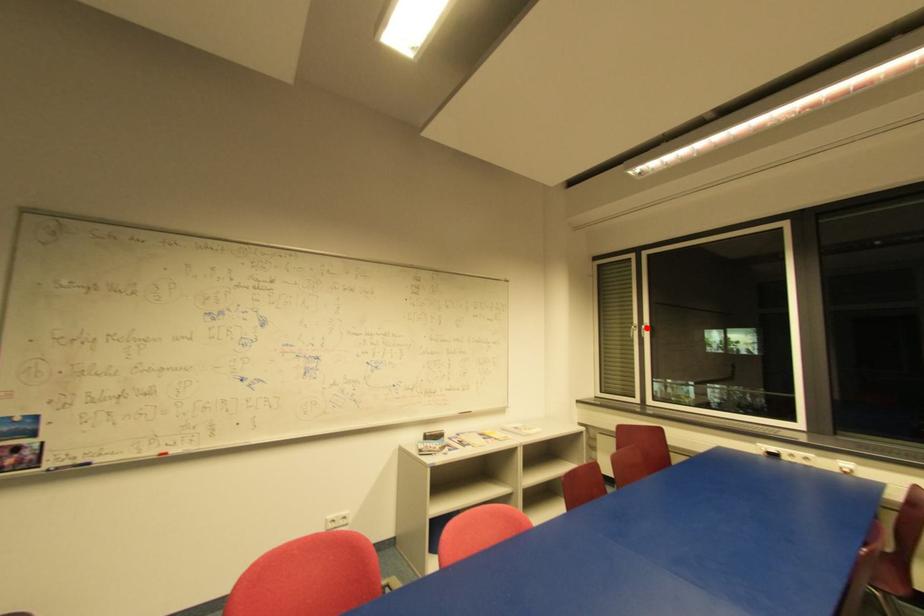
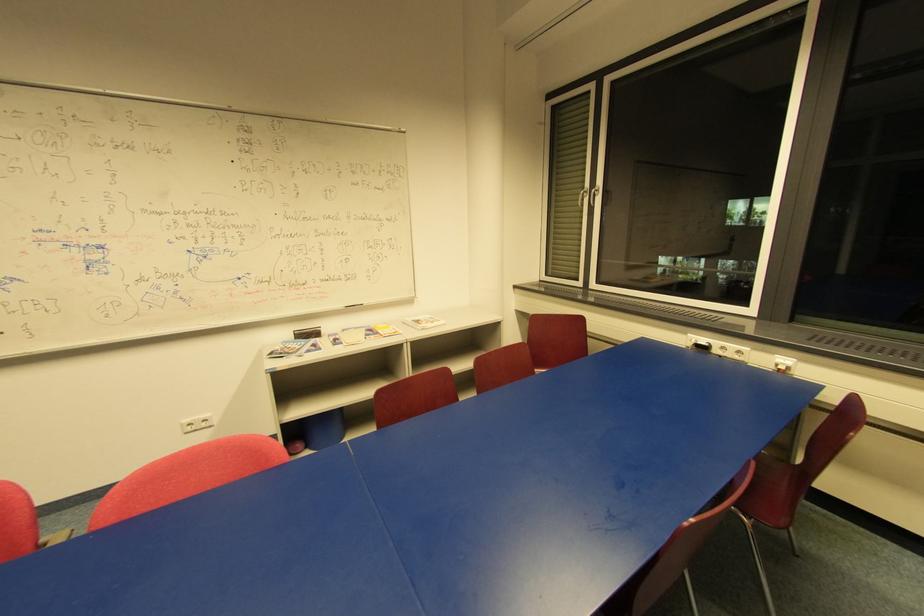
Question: I am providing you with two images of the same scene from different viewpoints. Given a red point in image1, look at the same physical point in image2. Is it:

Choices:
 (A) Closer to the viewpoint
 (B) Farther from the viewpoint

Answer: (A)